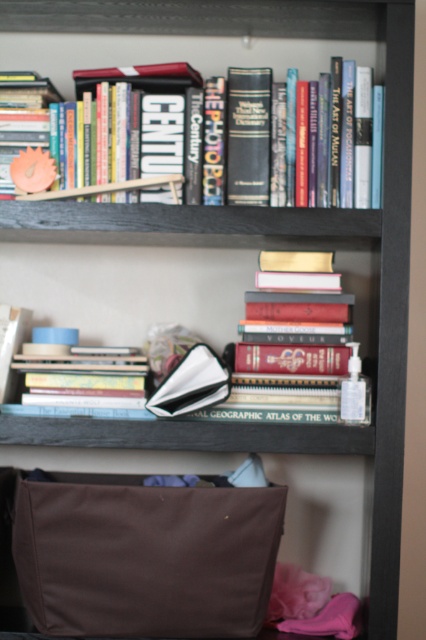
Is hardcover books at center thinner than hardcover book at upper center?

Yes, hardcover books at center is thinner than hardcover book at upper center.

Is point (230, 272) positioned after point (143, 113)?

Yes, it is behind point (143, 113).

Who is more forward, (137,301) or (262,204)?

Positioned in front is point (262,204).

The image size is (426, 640). Find the location of `hardcover books at center`. hardcover books at center is located at coordinates (127, 289).